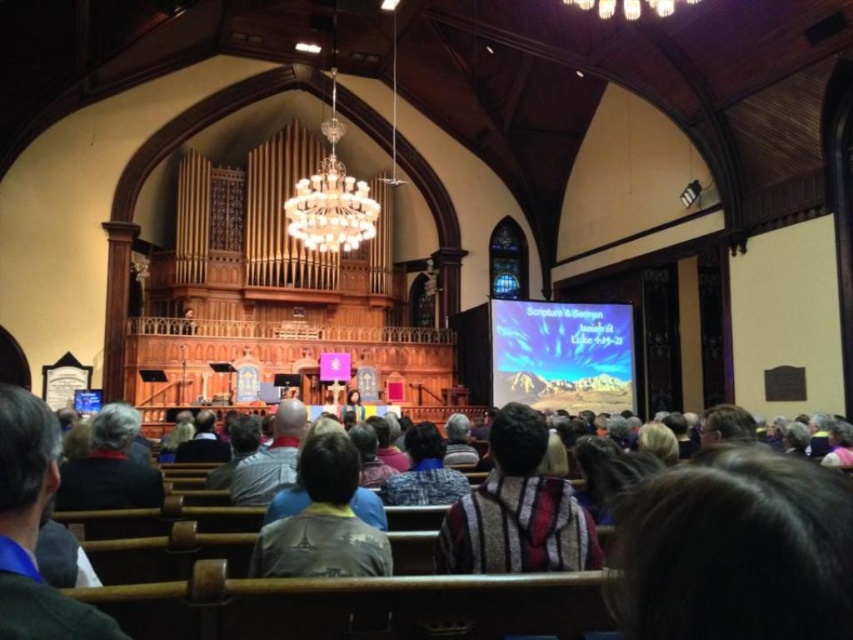
Does multicolored woven fabric at center have a lesser width compared to dark gray sweater at lower left?

No.

You are a GUI agent. You are given a task and a screenshot of the screen. Output one action in this format:
    pyautogui.click(x=<x>, y=<y>)
    Task: Click on the multicolored woven fabric at center
    
    Given the screenshot: What is the action you would take?
    [476, 573]

The width and height of the screenshot is (853, 640). Find the location of `multicolored woven fabric at center`. multicolored woven fabric at center is located at coordinates (476, 573).

Does multicolored woven fabric at center have a greater height compared to dark gray sweater at center?

Indeed, multicolored woven fabric at center has a greater height compared to dark gray sweater at center.

Can you confirm if multicolored woven fabric at center is positioned below dark gray sweater at center?

No, multicolored woven fabric at center is not below dark gray sweater at center.

Between point (431, 573) and point (410, 499), which one is positioned in front?

Point (431, 573) is more forward.

The height and width of the screenshot is (640, 853). Identify the location of multicolored woven fabric at center. (476, 573).

The image size is (853, 640). What are the coordinates of `camouflage jacket at center` in the screenshot? It's located at tap(323, 522).

Where is `camouflage jacket at center`? camouflage jacket at center is located at coordinates (323, 522).